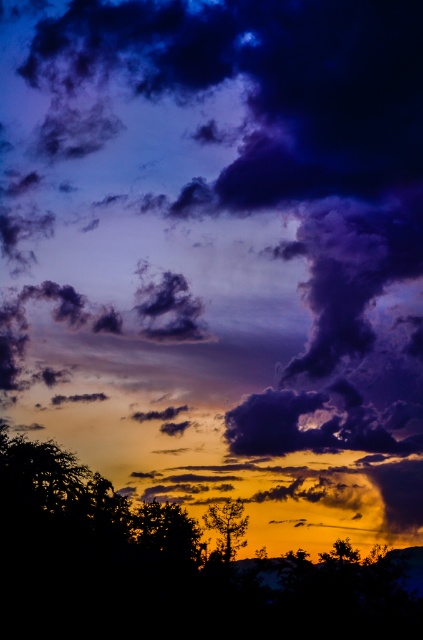
Question: Is silhouette leafy tree at lower center in front of silky black tree at lower right?

Choices:
 (A) yes
 (B) no

Answer: (A)

Question: Considering the real-world distances, which object is farthest from the silvery metallic tree at center?

Choices:
 (A) silhouette leafy tree at lower center
 (B) silky black tree at lower right

Answer: (B)

Question: From the image, what is the correct spatial relationship of silhouette leafy tree at lower center in relation to silky black tree at lower right?

Choices:
 (A) right
 (B) left

Answer: (B)

Question: Which point is closer to the camera?

Choices:
 (A) silky black tree at lower right
 (B) silvery metallic tree at center
 (C) silhouette leafy tree at lower center

Answer: (C)

Question: Which object is the farthest from the silvery metallic tree at center?

Choices:
 (A) silky black tree at lower right
 (B) silhouette leafy tree at lower center

Answer: (A)

Question: In this image, where is silhouette leafy tree at lower center located relative to silvery metallic tree at center?

Choices:
 (A) right
 (B) left

Answer: (B)